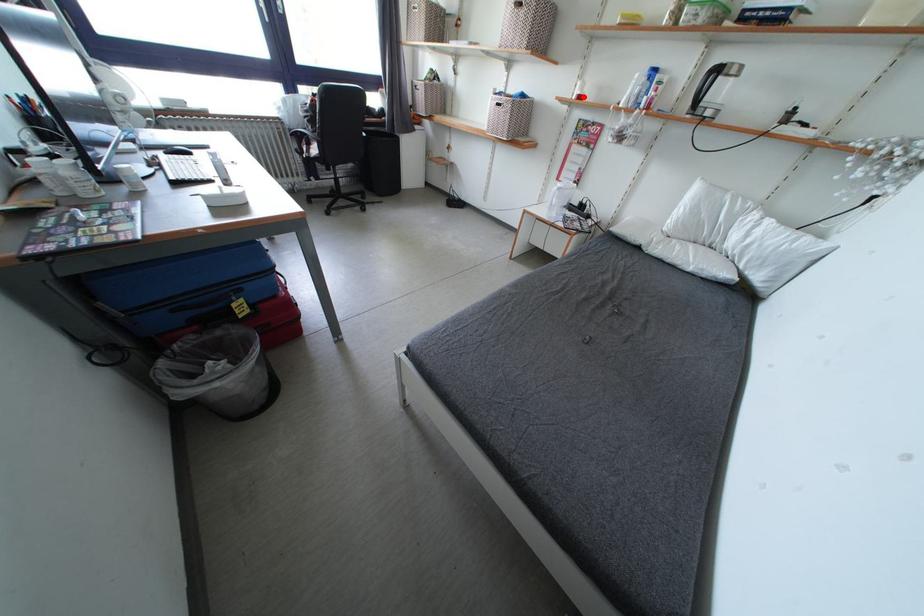
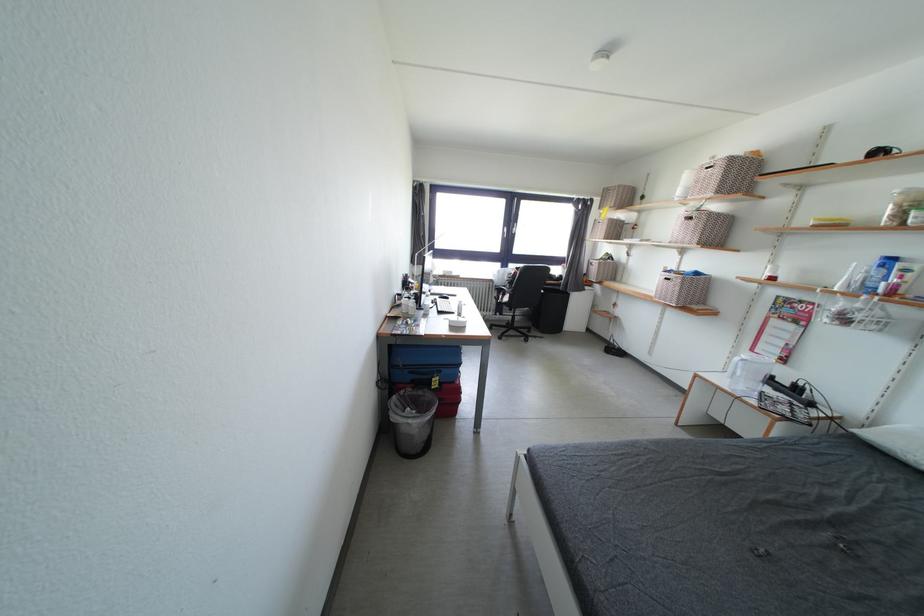
Question: I am providing you with two images of the same scene from different viewpoints. A red point is marked on the first image. Is the red point's position out of view in image 2?

Choices:
 (A) Yes
 (B) No

Answer: (B)